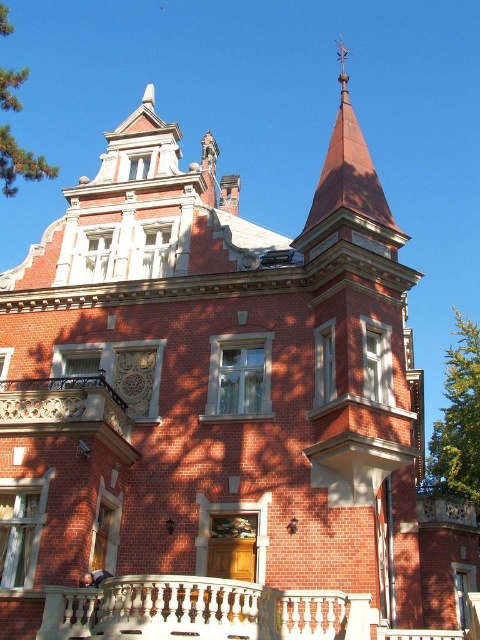
Can you confirm if rustic wood balcony at center is positioned below green leafy tree at right?

Actually, rustic wood balcony at center is above green leafy tree at right.

This screenshot has height=640, width=480. What do you see at coordinates (67, 410) in the screenshot? I see `rustic wood balcony at center` at bounding box center [67, 410].

Which is in front, point (38, 390) or point (452, 387)?

Point (38, 390) is more forward.

Find the location of a particular element. The height and width of the screenshot is (640, 480). rustic wood balcony at center is located at coordinates (67, 410).

Can you confirm if rusty metal spire at upper center is positioned to the right of green leafy tree at right?

In fact, rusty metal spire at upper center is to the left of green leafy tree at right.

Between rusty metal spire at upper center and green leafy tree at right, which one is positioned lower?

green leafy tree at right is lower down.

Is point (345, 97) closer to viewer compared to point (432, 467)?

No, it is behind (432, 467).

The height and width of the screenshot is (640, 480). Find the location of `rusty metal spire at upper center`. rusty metal spire at upper center is located at coordinates (348, 180).

In the scene shown: Between rustic wood balcony at center and rusty metal spire at upper center, which one appears on the left side from the viewer's perspective?

rustic wood balcony at center

Consider the image. Is rustic wood balcony at center taller than rusty metal spire at upper center?

No.

The height and width of the screenshot is (640, 480). I want to click on rustic wood balcony at center, so click(x=67, y=410).

Identify the location of rustic wood balcony at center. (67, 410).